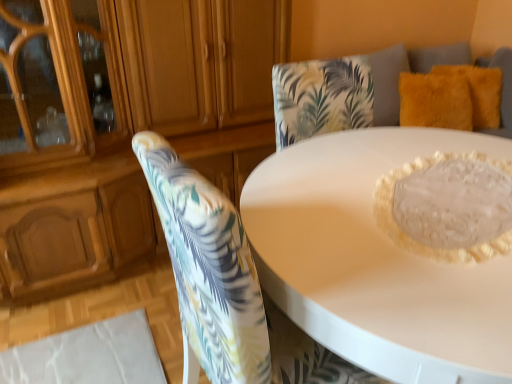
This screenshot has height=384, width=512. Identify the location of blank area beneath translucent glass cake at center (from a real-world perspective). (453, 205).